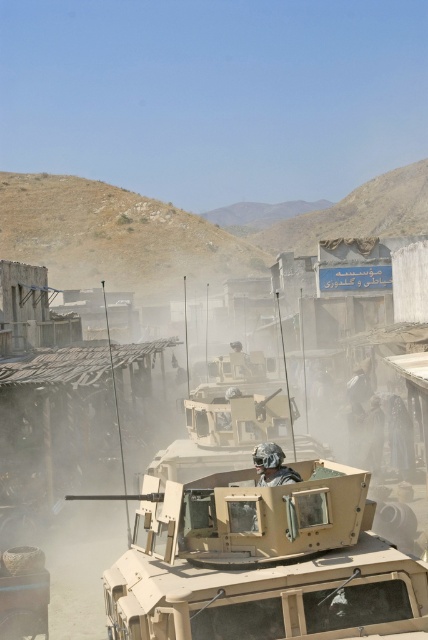
Describe the element at coordinates (261, 561) in the screenshot. I see `tan matte tank at center` at that location.

Does tan matte tank at center appear on the left side of camouflage helmet at center?

Indeed, tan matte tank at center is positioned on the left side of camouflage helmet at center.

This screenshot has height=640, width=428. I want to click on tan matte tank at center, so click(261, 561).